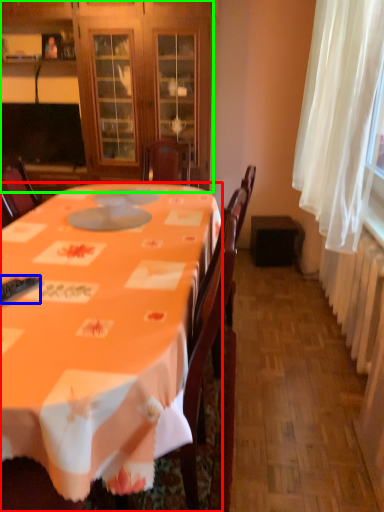
Question: Which object is positioned closest to desk (highlighted by a red box)? Select from remote control (highlighted by a blue box) and cabinetry (highlighted by a green box).

Choices:
 (A) remote control
 (B) cabinetry

Answer: (A)